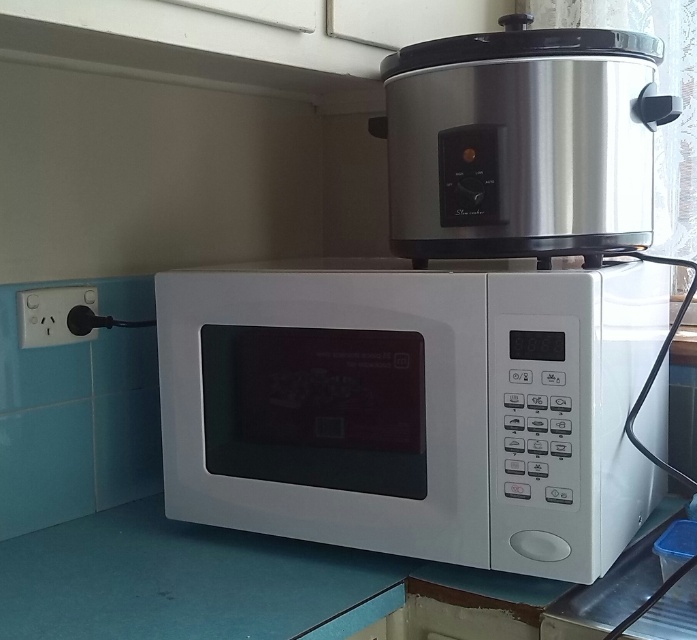
Question: Which point is closer to the camera?

Choices:
 (A) (625, 307)
 (B) (238, 557)

Answer: (A)

Question: Does white plastic microwave at center appear on the left side of satin silver cooker at upper center?

Choices:
 (A) yes
 (B) no

Answer: (A)

Question: Does satin silver cooker at upper center appear over white glossy countertop at lower center?

Choices:
 (A) yes
 (B) no

Answer: (A)

Question: Which point is farther from the camera taking this photo?

Choices:
 (A) (549, 186)
 (B) (155, 324)
 (C) (321, 611)

Answer: (B)

Question: Can you confirm if satin silver cooker at upper center is positioned below white glossy countertop at lower center?

Choices:
 (A) yes
 (B) no

Answer: (B)

Question: Among these objects, which one is nearest to the camera?

Choices:
 (A) white plastic microwave at center
 (B) satin silver cooker at upper center

Answer: (A)